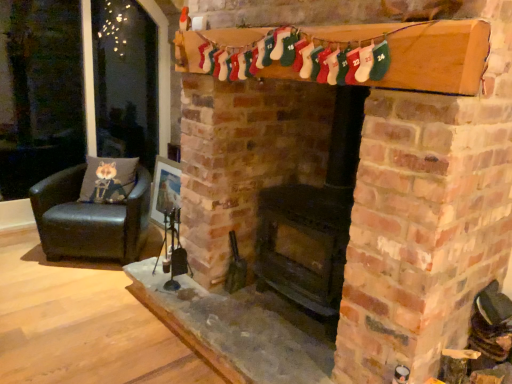
Measure the distance between black leather chair at left and camera.

black leather chair at left is 9.89 feet from camera.

Locate an element on the screen. The height and width of the screenshot is (384, 512). gray fabric cushion at left is located at coordinates (108, 179).

The width and height of the screenshot is (512, 384). What do you see at coordinates (271, 183) in the screenshot?
I see `black matte fireplace at center` at bounding box center [271, 183].

Image resolution: width=512 pixels, height=384 pixels. I want to click on black leather chair at left, so click(x=90, y=219).

Is gray fabric cushion at left in front of or behind black leather chair at left in the image?

In the image, gray fabric cushion at left appears behind black leather chair at left.

From the image's perspective, which one is positioned lower, gray fabric cushion at left or black leather chair at left?

black leather chair at left is shown below in the image.

Is gray fabric cushion at left far away from black leather chair at left?

No, there isn't a large distance between gray fabric cushion at left and black leather chair at left.

How many degrees apart are the facing directions of gray fabric cushion at left and black leather chair at left?

They differ by 0.00348 degrees in their facing directions.

Looking at this image, could you tell me if black leather chair at left is facing black matte fireplace at center?

No, black leather chair at left is not turned towards black matte fireplace at center.

Between black leather chair at left and black matte fireplace at center, which one has smaller size?

Smaller between the two is black leather chair at left.

How different are the orientations of black leather chair at left and black matte fireplace at center in degrees?

There is a 49.5-degree angle between the facing directions of black leather chair at left and black matte fireplace at center.

Which is in front, black leather chair at left or black matte fireplace at center?

black matte fireplace at center is in front.

I want to click on chair on the left of black matte fireplace at center, so click(90, 219).

Is black matte fireplace at center to the left or to the right of black leather chair at left in the image?

Based on their positions, black matte fireplace at center is located to the right of black leather chair at left.

Is black matte fireplace at center situated inside black leather chair at left or outside?

The correct answer is: outside.

Which point is more forward, [95,168] or [345,247]?

Positioned in front is point [345,247].

Based on their sizes in the image, would you say gray fabric cushion at left is bigger or smaller than black matte fireplace at center?

In the image, gray fabric cushion at left appears to be smaller than black matte fireplace at center.

Based on their positions, is gray fabric cushion at left located to the left or right of black matte fireplace at center?

Based on their positions, gray fabric cushion at left is located to the left of black matte fireplace at center.

Is gray fabric cushion at left facing towards black matte fireplace at center?

No, gray fabric cushion at left is not turned towards black matte fireplace at center.

Between black leather chair at left and gray fabric cushion at left, which one has smaller size?

With smaller size is gray fabric cushion at left.

Does black leather chair at left have a lesser width compared to gray fabric cushion at left?

No, black leather chair at left is not thinner than gray fabric cushion at left.

Which of these two, black leather chair at left or gray fabric cushion at left, stands shorter?

gray fabric cushion at left.

Could you tell me if black leather chair at left is turned towards gray fabric cushion at left?

No, black leather chair at left does not turn towards gray fabric cushion at left.

How much distance is there between black matte fireplace at center and gray fabric cushion at left?

The distance of black matte fireplace at center from gray fabric cushion at left is 1.33 meters.

From their relative heights in the image, would you say black matte fireplace at center is taller or shorter than gray fabric cushion at left?

Clearly, black matte fireplace at center is taller compared to gray fabric cushion at left.

Consider the image. Is there a large distance between black matte fireplace at center and gray fabric cushion at left?

Absolutely, black matte fireplace at center is distant from gray fabric cushion at left.

Is black matte fireplace at center situated inside gray fabric cushion at left or outside?

black matte fireplace at center is spatially situated outside gray fabric cushion at left.

There is a black leather chair at left. Where is `pillow above it (from a real-world perspective)`? pillow above it (from a real-world perspective) is located at coordinates (108, 179).

You are a GUI agent. You are given a task and a screenshot of the screen. Output one action in this format:
    pyautogui.click(x=<x>, y=<y>)
    Task: Click on the chair that is below the black matte fireplace at center (from the image's perspective)
    
    Given the screenshot: What is the action you would take?
    pyautogui.click(x=90, y=219)

Considering their positions, is black leather chair at left positioned closer to black matte fireplace at center than gray fabric cushion at left?

The object closer to black matte fireplace at center is black leather chair at left.

From the picture: When comparing their distances from gray fabric cushion at left, does black matte fireplace at center or black leather chair at left seem further?

Among the two, black matte fireplace at center is located further to gray fabric cushion at left.

From the image, which object appears to be nearer to gray fabric cushion at left, black leather chair at left or black matte fireplace at center?

Based on the image, black leather chair at left appears to be nearer to gray fabric cushion at left.

Which object lies further to the anchor point black leather chair at left, gray fabric cushion at left or black matte fireplace at center?

black matte fireplace at center lies further to black leather chair at left than the other object.

From the image, which object appears to be nearer to black leather chair at left, black matte fireplace at center or gray fabric cushion at left?

Based on the image, gray fabric cushion at left appears to be nearer to black leather chair at left.

Estimate the real-world distances between objects in this image. Which object is closer to black matte fireplace at center, gray fabric cushion at left or black leather chair at left?

black leather chair at left lies closer to black matte fireplace at center than the other object.

Find the location of a particular element. This screenshot has height=384, width=512. pillow between black leather chair at left and black matte fireplace at center in the horizontal direction is located at coordinates (108, 179).